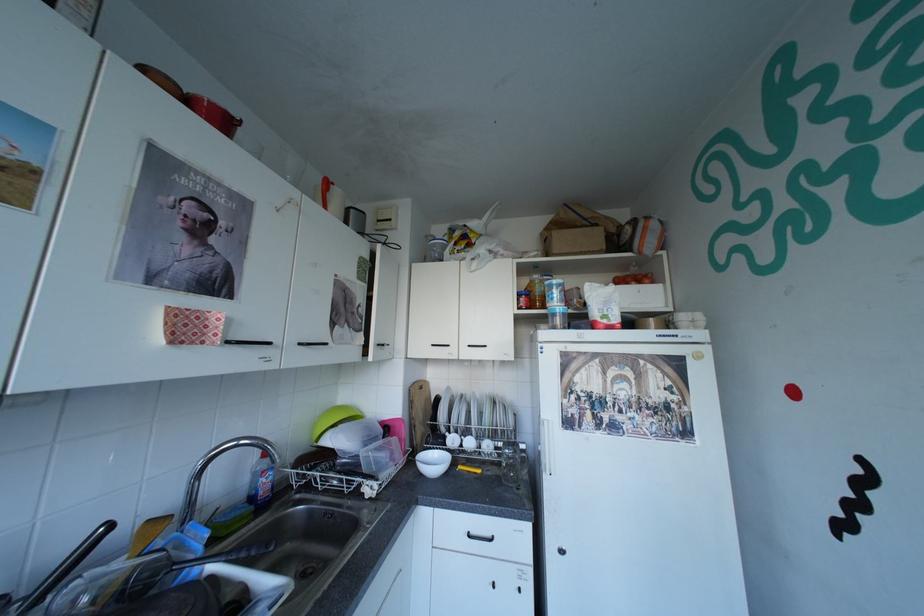
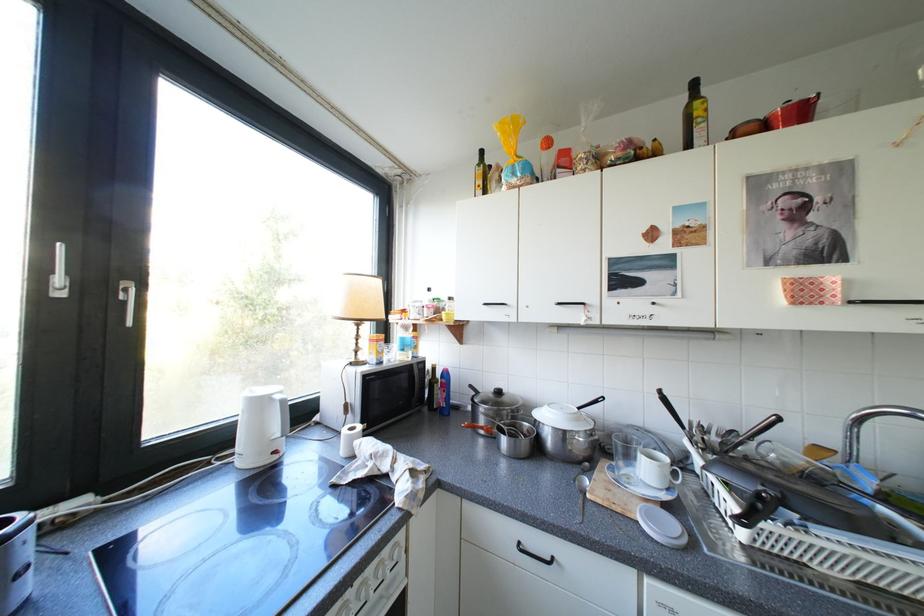
Question: The camera is either moving clockwise (left) or counter-clockwise (right) around the object. The first image is from the beginning of the video and the second image is from the end. Is the camera moving left or right when shooting the video?

Choices:
 (A) Left
 (B) Right

Answer: (B)